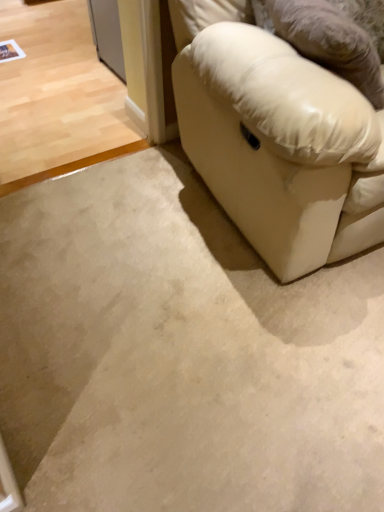
How much space does beige carpet at lower right, positioned as the first concrete in front-to-back order, occupy vertically?

The height of beige carpet at lower right, positioned as the first concrete in front-to-back order, is 1.35 inches.

The height and width of the screenshot is (512, 384). What do you see at coordinates (56, 93) in the screenshot?
I see `beige carpet at lower left, which is the second concrete in bottom-to-top order` at bounding box center [56, 93].

Consider the image. What is the approximate width of beige carpet at lower left, which is the first concrete from back to front?

8.02 feet.

This screenshot has width=384, height=512. What are the coordinates of `leather-like beige pillow at right` in the screenshot? It's located at (286, 96).

At what (x,y) coordinates should I click in order to perform the action: click on beige carpet at lower right, positioned as the second concrete in back-to-front order. Please return your answer as a coordinate pair (x, y). Looking at the image, I should click on (180, 354).

Considering the positions of objects leather-like beige pillow at right and white leather couch at lower right in the image provided, who is more to the right, leather-like beige pillow at right or white leather couch at lower right?

white leather couch at lower right.

From a real-world perspective, is leather-like beige pillow at right on top of white leather couch at lower right?

Indeed, from a real-world perspective, leather-like beige pillow at right stands above white leather couch at lower right.

Does leather-like beige pillow at right have a greater width compared to white leather couch at lower right?

No, leather-like beige pillow at right is not wider than white leather couch at lower right.

From the image's perspective, would you say white leather couch at lower right is shown under leather-like beige pillow at right?

A: Actually, white leather couch at lower right appears above leather-like beige pillow at right in the image.

How many degrees apart are the facing directions of white leather couch at lower right and leather-like beige pillow at right?

There is a 84.1-degree angle between the facing directions of white leather couch at lower right and leather-like beige pillow at right.

Is white leather couch at lower right positioned beyond the bounds of leather-like beige pillow at right?

white leather couch at lower right is positioned outside leather-like beige pillow at right.

Does white leather couch at lower right appear on the right side of leather-like beige pillow at right?

Yes.

Relative to beige carpet at lower right, positioned as the first concrete in front-to-back order, is beige carpet at lower left, the second concrete from the front, in front or behind?

beige carpet at lower left, the second concrete from the front, is positioned farther from the viewer than beige carpet at lower right, positioned as the first concrete in front-to-back order.

Which of these two, beige carpet at lower left, which is the second concrete in bottom-to-top order, or beige carpet at lower right, which appears as the first concrete when ordered from the bottom, is smaller?

beige carpet at lower right, which appears as the first concrete when ordered from the bottom.

Which is in front, point (73, 37) or point (158, 433)?

The point (158, 433) is closer to the camera.

From a real-world perspective, which is physically above, beige carpet at lower left, which is the first concrete from back to front, or beige carpet at lower right, which appears as the second concrete when viewed from the top?

beige carpet at lower left, which is the first concrete from back to front.

Does beige carpet at lower right, which appears as the first concrete when ordered from the bottom, have a lesser width compared to white leather couch at lower right?

No, beige carpet at lower right, which appears as the first concrete when ordered from the bottom, is not thinner than white leather couch at lower right.

Who is more distant, beige carpet at lower right, positioned as the first concrete in front-to-back order, or white leather couch at lower right?

beige carpet at lower right, positioned as the first concrete in front-to-back order, is further from the camera.

Choose the correct answer: Is beige carpet at lower right, positioned as the second concrete in back-to-front order, inside white leather couch at lower right or outside it?

beige carpet at lower right, positioned as the second concrete in back-to-front order, is not enclosed by white leather couch at lower right.

Can you confirm if beige carpet at lower right, positioned as the second concrete in back-to-front order, is smaller than white leather couch at lower right?

Correct, beige carpet at lower right, positioned as the second concrete in back-to-front order, occupies less space than white leather couch at lower right.

Considering the relative sizes of white leather couch at lower right and beige carpet at lower right, which appears as the first concrete when ordered from the bottom, in the image provided, is white leather couch at lower right bigger than beige carpet at lower right, which appears as the first concrete when ordered from the bottom,?

Yes, white leather couch at lower right is bigger than beige carpet at lower right, which appears as the first concrete when ordered from the bottom.

Which of these two, white leather couch at lower right or beige carpet at lower right, positioned as the second concrete in back-to-front order, is thinner?

white leather couch at lower right.

From a real-world perspective, is beige carpet at lower right, which appears as the first concrete when ordered from the bottom, above or below beige carpet at lower left, which is the second concrete in bottom-to-top order?

beige carpet at lower right, which appears as the first concrete when ordered from the bottom, is situated lower than beige carpet at lower left, which is the second concrete in bottom-to-top order, in the real world.

Does beige carpet at lower right, positioned as the second concrete in back-to-front order, contain beige carpet at lower left, the second concrete from the front?

No, beige carpet at lower left, the second concrete from the front, is not inside beige carpet at lower right, positioned as the second concrete in back-to-front order.

Looking at this image, how different are the orientations of beige carpet at lower right, positioned as the first concrete in front-to-back order, and beige carpet at lower left, which is the second concrete in bottom-to-top order, in degrees?

The angular difference between beige carpet at lower right, positioned as the first concrete in front-to-back order, and beige carpet at lower left, which is the second concrete in bottom-to-top order, is 89.3 degrees.

Is there a large distance between beige carpet at lower right, which appears as the first concrete when ordered from the bottom, and beige carpet at lower left, positioned as the 1th concrete in top-to-bottom order?

Yes, beige carpet at lower right, which appears as the first concrete when ordered from the bottom, and beige carpet at lower left, positioned as the 1th concrete in top-to-bottom order, are located far from each other.

Based on the photo, considering the positions of objects beige carpet at lower right, which appears as the first concrete when ordered from the bottom, and leather-like beige pillow at right in the image provided, who is in front, beige carpet at lower right, which appears as the first concrete when ordered from the bottom, or leather-like beige pillow at right?

beige carpet at lower right, which appears as the first concrete when ordered from the bottom, is more forward.

Can you see beige carpet at lower right, positioned as the first concrete in front-to-back order, touching leather-like beige pillow at right?

No, beige carpet at lower right, positioned as the first concrete in front-to-back order, is not touching leather-like beige pillow at right.

Is point (296, 307) in front of point (219, 54)?

That is False.

You are a GUI agent. You are given a task and a screenshot of the screen. Output one action in this format:
    pyautogui.click(x=<x>, y=<y>)
    Task: Click on the pillow below the white leather couch at lower right (from the image's perspective)
    This screenshot has width=384, height=512.
    Given the screenshot: What is the action you would take?
    pyautogui.click(x=286, y=96)

Where is `pillow positioned vertically above the white leather couch at lower right (from a real-world perspective)`? pillow positioned vertically above the white leather couch at lower right (from a real-world perspective) is located at coordinates (286, 96).

Estimate the real-world distances between objects in this image. Which object is closer to leather-like beige pillow at right, beige carpet at lower right, positioned as the first concrete in front-to-back order, or white leather couch at lower right?

Among the two, white leather couch at lower right is located nearer to leather-like beige pillow at right.

Consider the image. Looking at the image, which one is located closer to white leather couch at lower right, beige carpet at lower right, which appears as the second concrete when viewed from the top, or beige carpet at lower left, which is the second concrete in bottom-to-top order?

The object closer to white leather couch at lower right is beige carpet at lower right, which appears as the second concrete when viewed from the top.

Considering their positions, is beige carpet at lower left, positioned as the 1th concrete in top-to-bottom order, positioned closer to white leather couch at lower right than beige carpet at lower right, which appears as the second concrete when viewed from the top?

beige carpet at lower right, which appears as the second concrete when viewed from the top, lies closer to white leather couch at lower right than the other object.

Which object lies nearer to the anchor point leather-like beige pillow at right, beige carpet at lower left, positioned as the 1th concrete in top-to-bottom order, or white leather couch at lower right?

white leather couch at lower right lies closer to leather-like beige pillow at right than the other object.

Estimate the real-world distances between objects in this image. Which object is further from beige carpet at lower left, which is the first concrete from back to front, beige carpet at lower right, which appears as the first concrete when ordered from the bottom, or leather-like beige pillow at right?

leather-like beige pillow at right.

Estimate the real-world distances between objects in this image. Which object is closer to beige carpet at lower left, which is the first concrete from back to front, white leather couch at lower right or leather-like beige pillow at right?

white leather couch at lower right is positioned closer to the anchor beige carpet at lower left, which is the first concrete from back to front.

Based on their spatial positions, is leather-like beige pillow at right or white leather couch at lower right further from beige carpet at lower left, which is the second concrete in bottom-to-top order?

leather-like beige pillow at right lies further to beige carpet at lower left, which is the second concrete in bottom-to-top order, than the other object.

From the image, which object appears to be farther from leather-like beige pillow at right, white leather couch at lower right or beige carpet at lower right, positioned as the first concrete in front-to-back order?

beige carpet at lower right, positioned as the first concrete in front-to-back order, is positioned further to the anchor leather-like beige pillow at right.

You are a GUI agent. You are given a task and a screenshot of the screen. Output one action in this format:
    pyautogui.click(x=<x>, y=<y>)
    Task: Click on the pillow located between beige carpet at lower left, positioned as the 1th concrete in top-to-bottom order, and white leather couch at lower right in the left-right direction
    This screenshot has height=512, width=384.
    Given the screenshot: What is the action you would take?
    pyautogui.click(x=286, y=96)

You are a GUI agent. You are given a task and a screenshot of the screen. Output one action in this format:
    pyautogui.click(x=<x>, y=<y>)
    Task: Click on the pillow that lies between beige carpet at lower left, positioned as the 1th concrete in top-to-bottom order, and beige carpet at lower right, which appears as the second concrete when viewed from the top, from top to bottom
    
    Given the screenshot: What is the action you would take?
    pyautogui.click(x=286, y=96)

Locate an element on the screen. This screenshot has width=384, height=512. concrete situated between beige carpet at lower left, which is the second concrete in bottom-to-top order, and white leather couch at lower right from left to right is located at coordinates (180, 354).

Where is `pillow that lies between white leather couch at lower right and beige carpet at lower right, positioned as the second concrete in back-to-front order, from top to bottom`? This screenshot has height=512, width=384. pillow that lies between white leather couch at lower right and beige carpet at lower right, positioned as the second concrete in back-to-front order, from top to bottom is located at coordinates (286, 96).